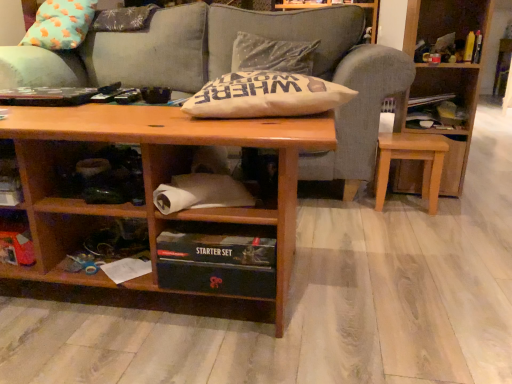
Locate an element on the screen. Image resolution: width=512 pixels, height=384 pixels. free space underneath matte cardboard paper at lower center, the 1th cabinet from the top (from a real-world perspective) is located at coordinates (219, 230).